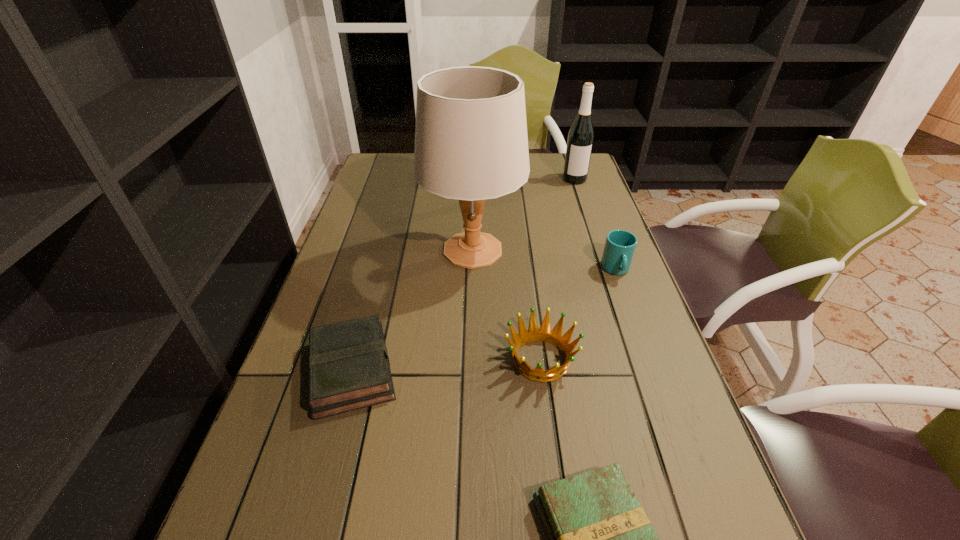
Find the location of `the tallest object`. the tallest object is located at coordinates (471, 144).

Where is `the farthest object`? Image resolution: width=960 pixels, height=540 pixels. the farthest object is located at coordinates click(x=581, y=135).

This screenshot has width=960, height=540. What are the coordinates of `wine bottle` in the screenshot? It's located at (581, 135).

The width and height of the screenshot is (960, 540). Identify the location of the fourth shortest object. (620, 245).

This screenshot has height=540, width=960. I want to click on the fourth tallest object, so click(x=544, y=334).

What are the coordinates of `the left book` in the screenshot? It's located at (349, 369).

The image size is (960, 540). Identify the location of the leftmost object. (349, 369).

Where is `vacant position located 0.200m on the left of the tallest object`? The width and height of the screenshot is (960, 540). vacant position located 0.200m on the left of the tallest object is located at coordinates pyautogui.click(x=350, y=251).

Where is `free location located on the label of the farthest object`? free location located on the label of the farthest object is located at coordinates (598, 252).

Find the location of a particular element. The width and height of the screenshot is (960, 540). vacant space located 0.140m on the handle side of the fourth shortest object is located at coordinates (636, 323).